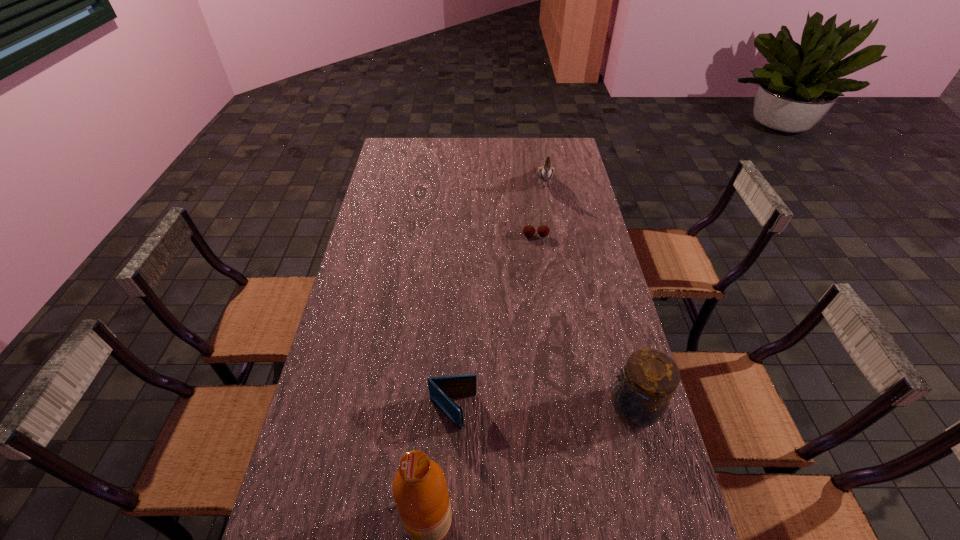
Find the location of `the second closest object to the wallet`. the second closest object to the wallet is located at coordinates (649, 379).

This screenshot has width=960, height=540. Find the location of `vacant region that satisfies the following two spatial constraints: 1. on the back side of the farthest object; 2. on the left side of the fourth nearest object`. vacant region that satisfies the following two spatial constraints: 1. on the back side of the farthest object; 2. on the left side of the fourth nearest object is located at coordinates (528, 181).

You are a GUI agent. You are given a task and a screenshot of the screen. Output one action in this format:
    pyautogui.click(x=<x>, y=<y>)
    Task: Click on the vacant area that satisfies the following two spatial constraints: 1. on the back side of the bird; 2. on the left side of the second farthest object
    
    Given the screenshot: What is the action you would take?
    pyautogui.click(x=528, y=181)

I want to click on free space in the image that satisfies the following two spatial constraints: 1. on the front side of the rightmost object; 2. on the lid of the bird, so click(x=585, y=407).